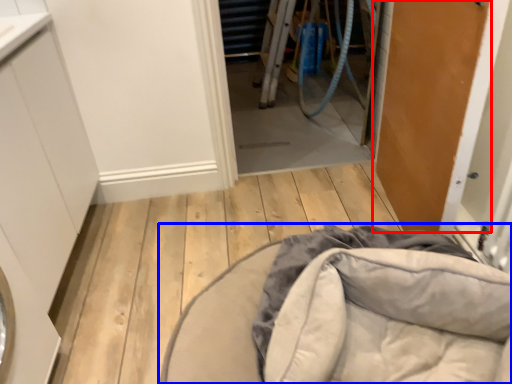
Question: Which object is further to the camera taking this photo, door (highlighted by a red box) or furniture (highlighted by a blue box)?

Choices:
 (A) door
 (B) furniture

Answer: (B)